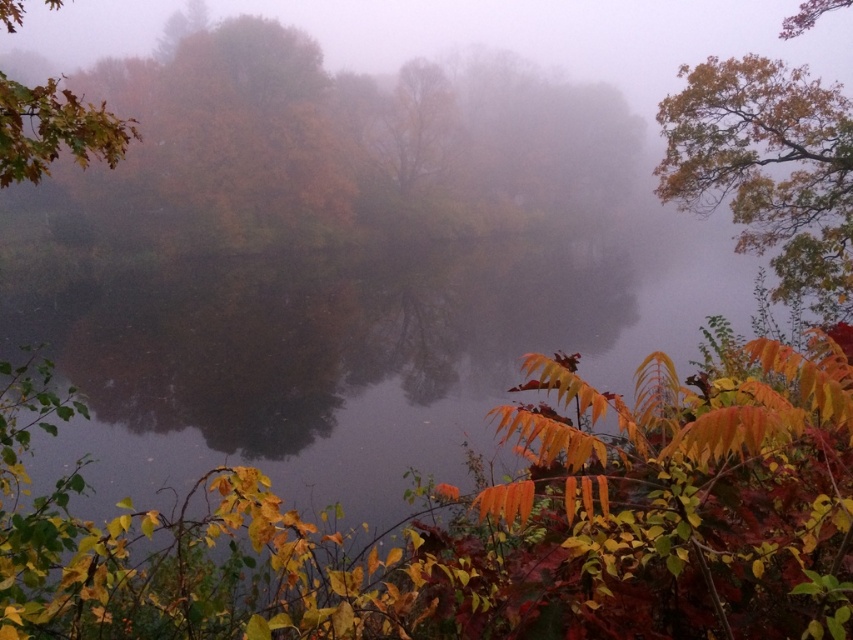
You are an artist sketching the autumn scene and want to draw the autumn leaves at left and shiny brown leaves at upper left accurately. Which of these two objects is positioned more to the left side of the image?

The shiny brown leaves at upper left are positioned more to the left side of the image compared to the autumn leaves at left, as the autumn leaves at left is to the right of shiny brown leaves at upper left.